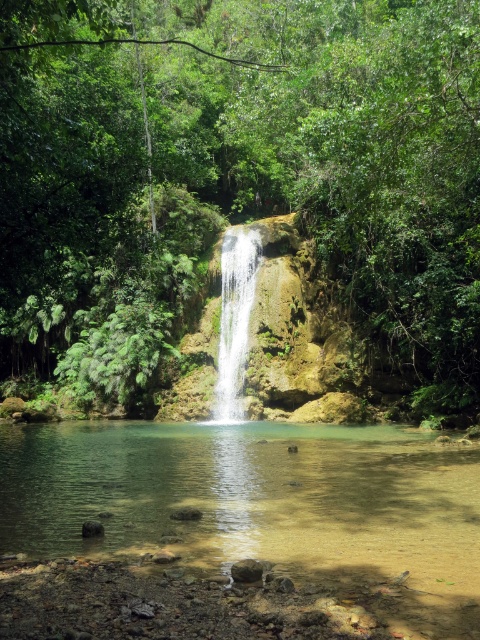
Looking at this image, which is more to the left, clear water at center or white smooth waterfall at center?

white smooth waterfall at center is more to the left.

Where is `clear water at center`? clear water at center is located at coordinates (262, 506).

Find the location of a particular element. This screenshot has width=480, height=640. clear water at center is located at coordinates (262, 506).

Is green leafy tree at center further to the viewer compared to white smooth waterfall at center?

That is False.

Which is above, green leafy tree at center or white smooth waterfall at center?

Positioned higher is green leafy tree at center.

Who is more forward, (239, 88) or (223, 380)?

Point (223, 380) is in front.

This screenshot has height=640, width=480. Find the location of `green leafy tree at center`. green leafy tree at center is located at coordinates pyautogui.click(x=238, y=182).

Can you confirm if green leafy tree at center is taller than clear water at center?

Correct, green leafy tree at center is much taller as clear water at center.

Which is behind, point (288, 35) or point (240, 513)?

Positioned behind is point (288, 35).

Which is behind, point (272, 336) or point (466, 451)?

Point (272, 336)

Image resolution: width=480 pixels, height=640 pixels. I want to click on green leafy tree at center, so click(x=238, y=182).